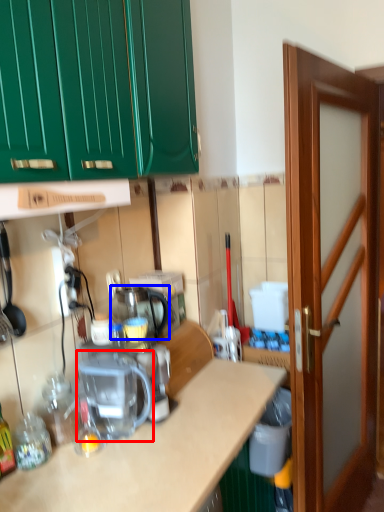
Question: Among these objects, which one is nearest to the camera, coffee machine (highlighted by a red box) or appliance (highlighted by a blue box)?

Choices:
 (A) coffee machine
 (B) appliance

Answer: (A)